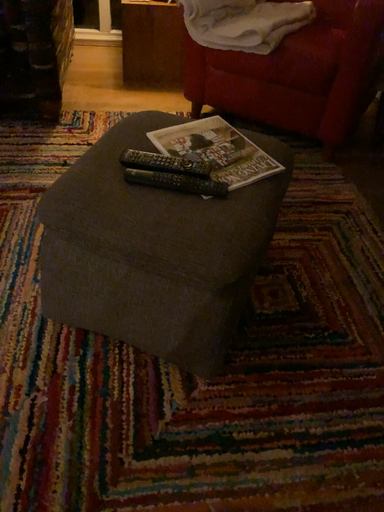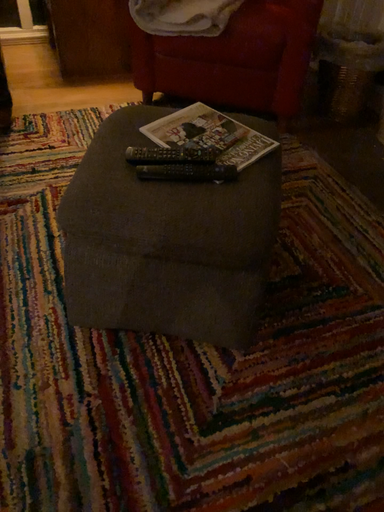
Question: Which way did the camera rotate in the video?

Choices:
 (A) rotated left
 (B) rotated right

Answer: (B)